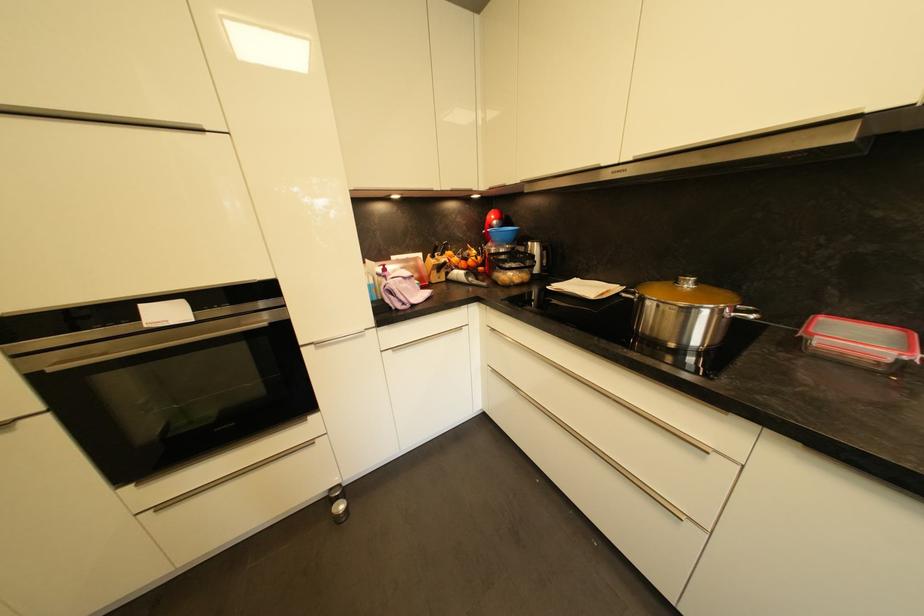
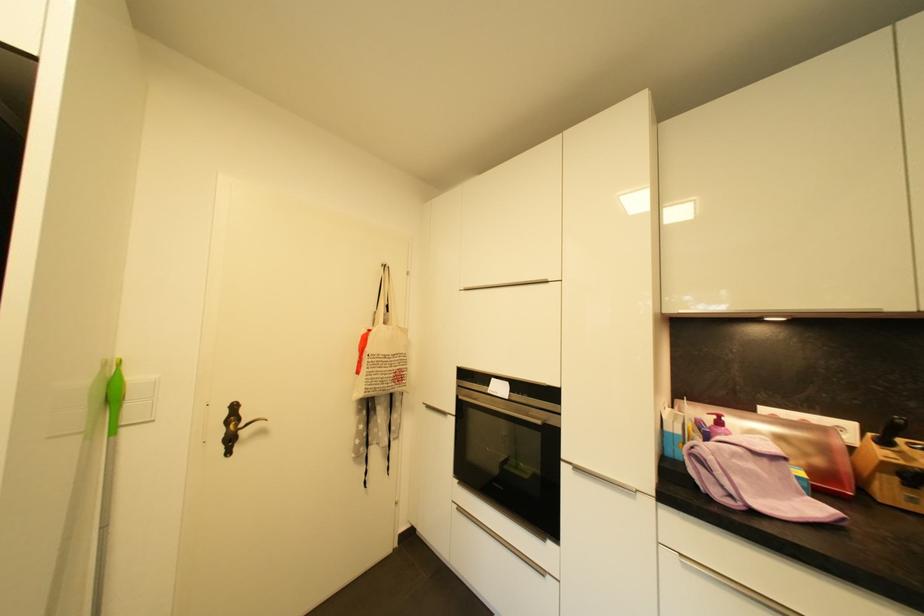
Question: I am providing you with two images of the same scene from different viewpoints. Which of the following objects are not visible in image2?

Choices:
 (A) white light switch
 (B) cloth tote bag
 (C) metal cabinet handle
 (D) none of these

Answer: (D)